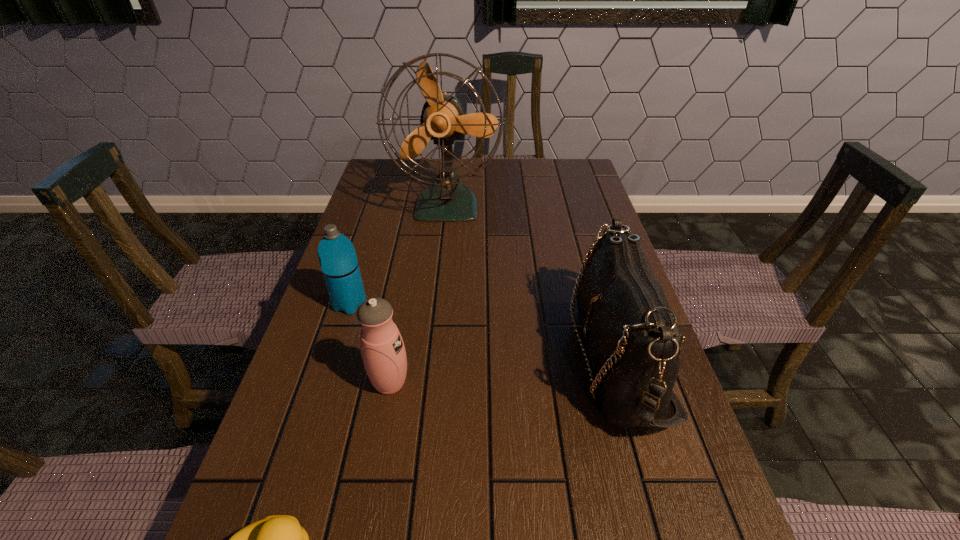
The image size is (960, 540). I want to click on free spot between the tallest object and the right thermos bottle, so click(419, 294).

Identify the location of unoccupied position between the fan and the farther thermos bottle. (398, 254).

The height and width of the screenshot is (540, 960). I want to click on free space between the fan and the nearer thermos bottle, so click(419, 294).

This screenshot has height=540, width=960. Identify the location of the second closest object relative to the right thermos bottle. (278, 539).

You are a GUI agent. You are given a task and a screenshot of the screen. Output one action in this format:
    pyautogui.click(x=<x>, y=<y>)
    Task: Click on the object that can be found as the fourth closest to the duck
    This screenshot has width=960, height=540.
    Given the screenshot: What is the action you would take?
    pyautogui.click(x=442, y=120)